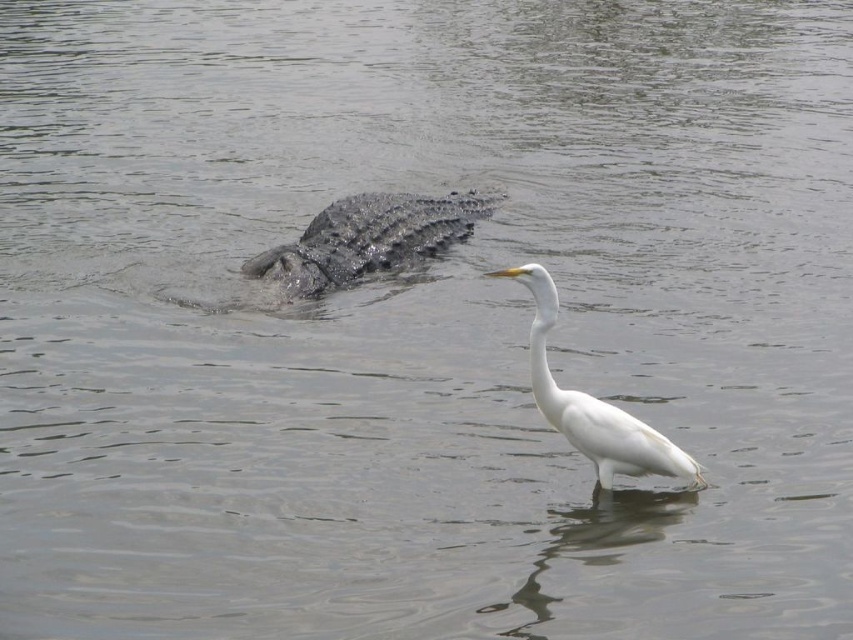
You are a photographer standing at the edge of the water, aiming to capture a clear photo of the dark gray scaly crocodile at center. Considering the crocodile is 13.38 meters away from you, what should you adjust on your camera to ensure the crocodile is in focus and sharp?

To ensure the dark gray scaly crocodile at center is in focus and sharp, you should adjust your camera to a smaller aperture setting, such as f8 or higher, to increase the depth of field. Additionally, using a tripod and a fast shutter speed will help minimize motion blur caused by the crocodile moving or any camera shake from pressing the shutter.

You are a photographer taking a picture of the dark gray scaly crocodile at center and the white smooth bird at center. Which animal should you focus on first if you want to capture both in the same frame without moving the camera?

You should focus on the dark gray scaly crocodile at center first because it is positioned to the left of the white smooth bird at center, allowing both to be in the same frame when starting from the left side.

You are a wildlife photographer aiming to capture a photo of the white smooth bird at center and the dark gray scaly crocodile at center. Your camera has a maximum zoom range of 5 meters. Can you fit both subjects into the frame without moving closer?

The distance between the dark gray scaly crocodile at center and the white smooth bird at center is 5.41 meters. Since your camera can only zoom up to 5 meters, you cannot capture both subjects in the same frame without moving closer.